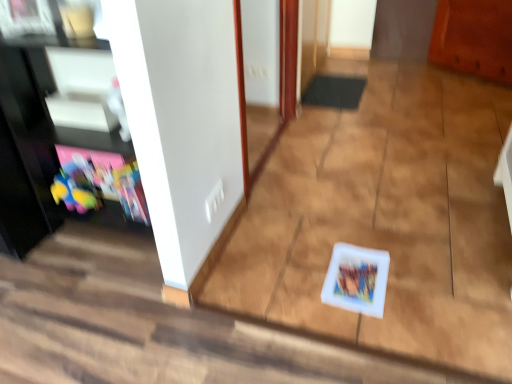
Where is `free spot below black rubber doormat at center (from a real-world perspective)`? free spot below black rubber doormat at center (from a real-world perspective) is located at coordinates (335, 91).